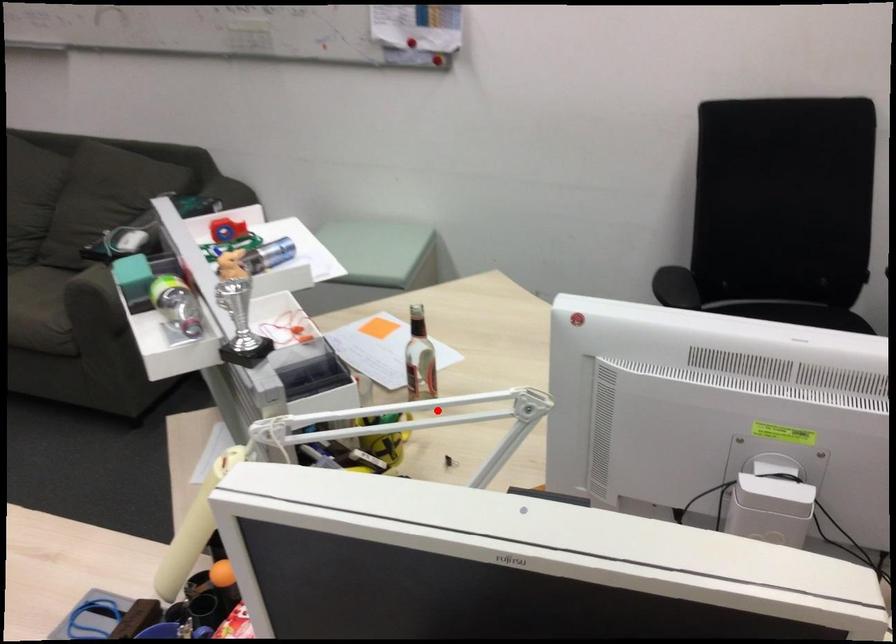
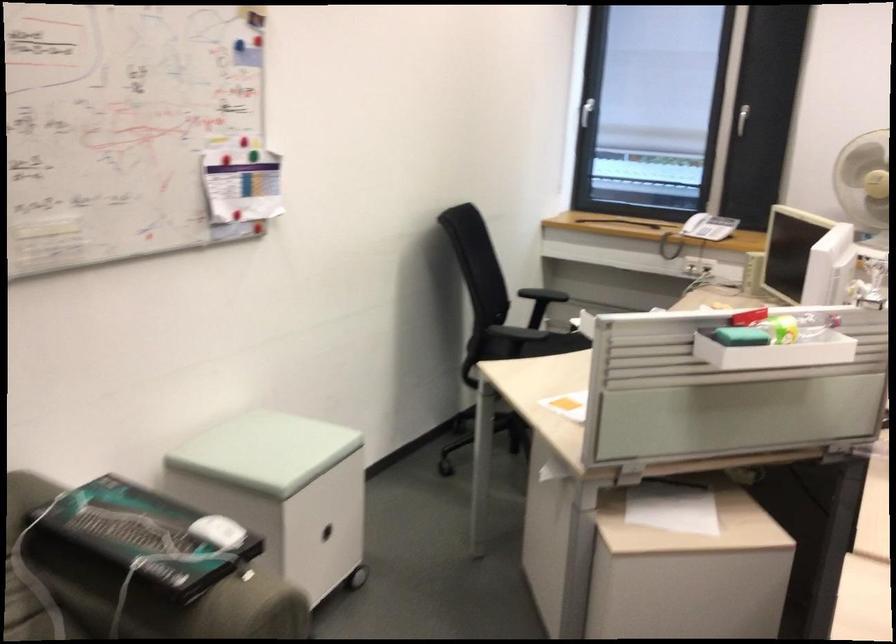
Question: I am providing you with two images of the same scene from different viewpoints. A red point is marked on the first image. Can you still see the location of the red point in image 2?

Choices:
 (A) Yes
 (B) No

Answer: (B)